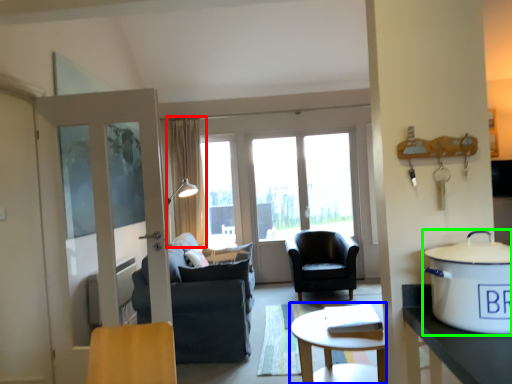
Question: Which is farther away from curtain (highlighted by a red box)? coffee table (highlighted by a blue box) or cooker (highlighted by a green box)?

Choices:
 (A) coffee table
 (B) cooker

Answer: (B)